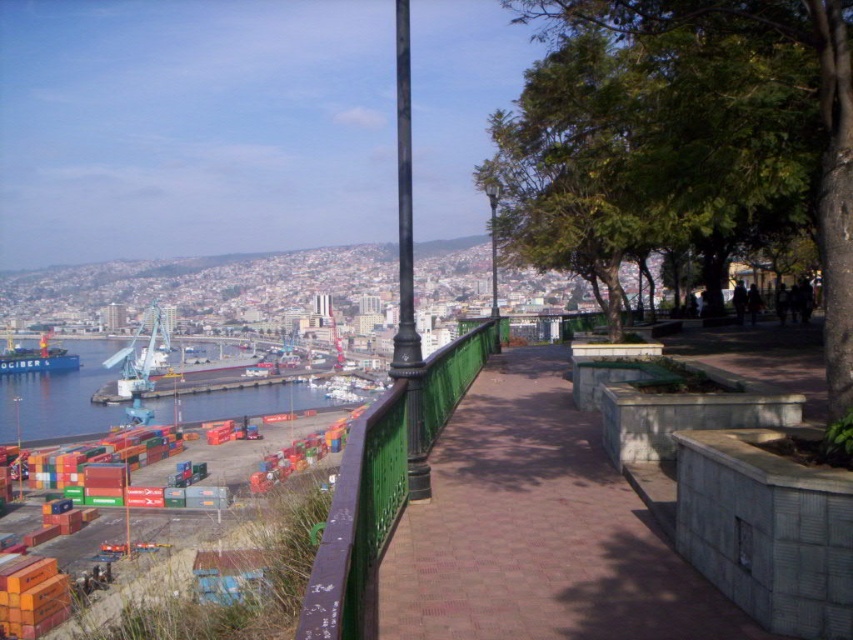
Question: Which of the following is the farthest from the observer?

Choices:
 (A) green wrought iron pole at center
 (B) green wrought iron railing at center
 (C) brick paved walkway at center
 (D) metallic pole at center

Answer: (D)

Question: Does green wrought iron railing at center have a smaller size compared to metallic pole at center?

Choices:
 (A) no
 (B) yes

Answer: (B)

Question: Which point is closer to the camera?

Choices:
 (A) green wrought iron railing at center
 (B) brick paved walkway at center
 (C) green wrought iron pole at center
 (D) metallic pole at center

Answer: (A)

Question: Is brick paved walkway at center closer to the viewer compared to green wrought iron railing at center?

Choices:
 (A) no
 (B) yes

Answer: (A)

Question: Is brick paved walkway at center smaller than metallic pole at center?

Choices:
 (A) yes
 (B) no

Answer: (A)

Question: Which point is closer to the camera?

Choices:
 (A) (426, 371)
 (B) (492, 220)
 (C) (489, 474)
 (D) (404, 26)

Answer: (C)